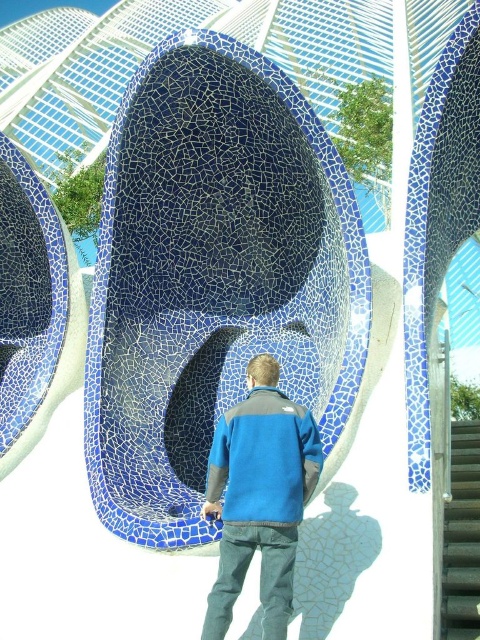
You are planning to sit on the blue mosaic bench at center and the gray textured stair at center. Based on their sizes, which one would be more comfortable for sitting?

The blue mosaic bench at center is bigger than the gray textured stair at center, so it would be more comfortable for sitting.

You are standing at point (213, 275) in the image. What object are you standing on?

You are standing on the blue mosaic bench at center located at point (213, 275).